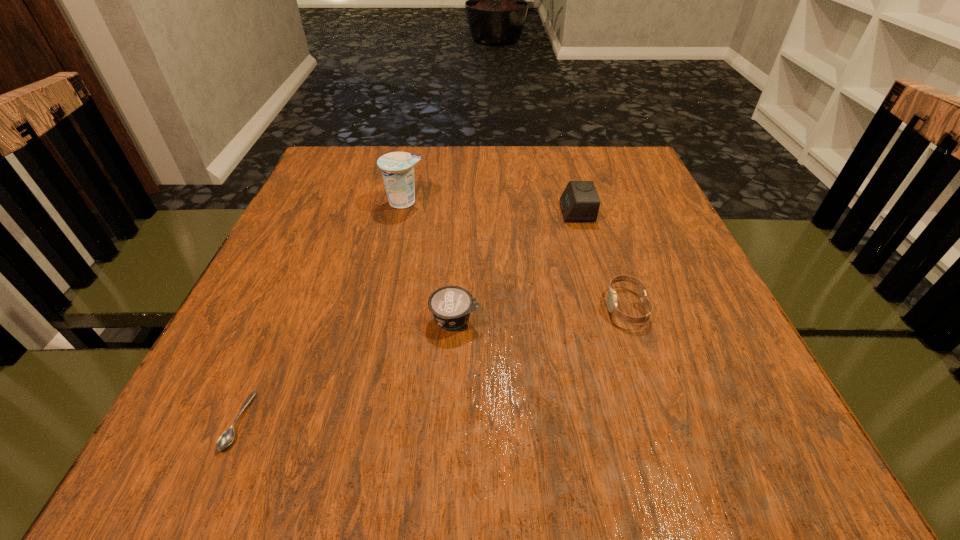
Find the location of `the tallest object`. the tallest object is located at coordinates (397, 168).

Image resolution: width=960 pixels, height=540 pixels. What are the coordinates of `the taller yogurt` in the screenshot? It's located at (397, 168).

The height and width of the screenshot is (540, 960). I want to click on the fourth shortest object, so [579, 202].

You are a GUI agent. You are given a task and a screenshot of the screen. Output one action in this format:
    pyautogui.click(x=<x>, y=<y>)
    Task: Click on the watch
    
    Given the screenshot: What is the action you would take?
    pyautogui.click(x=611, y=296)

This screenshot has width=960, height=540. Identify the location of the right yogurt. (451, 306).

Identify the location of the shorter yogurt. The width and height of the screenshot is (960, 540). (451, 306).

I want to click on soupspoon, so click(227, 437).

In order to click on the shortest object in this screenshot , I will do `click(227, 437)`.

You are a GUI agent. You are given a task and a screenshot of the screen. Output one action in this format:
    pyautogui.click(x=<x>, y=<y>)
    Task: Click on the vacant region located on the right of the tallest object
    The height and width of the screenshot is (540, 960).
    Given the screenshot: What is the action you would take?
    pyautogui.click(x=579, y=202)

Find the location of a particular element. free space located 0.370m on the front-facing side of the alarm clock is located at coordinates (399, 212).